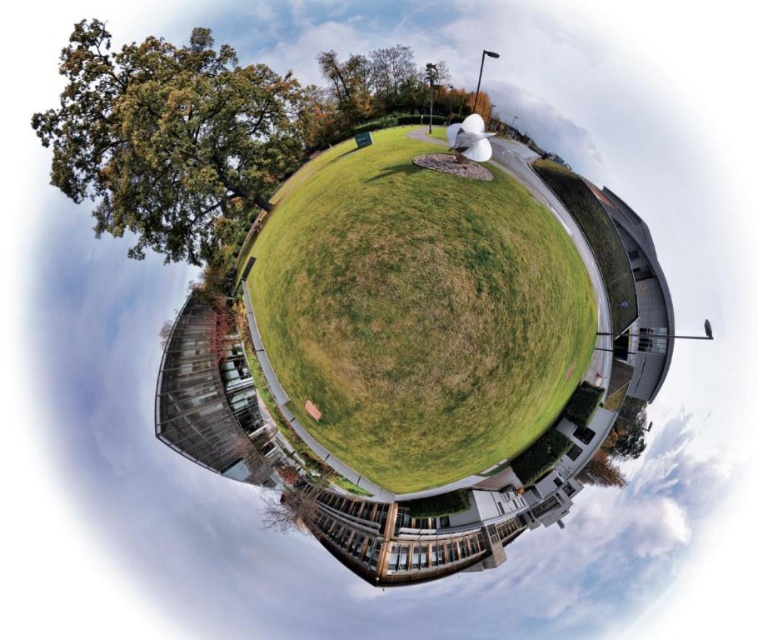
Question: Is green grassy at center closer to camera compared to green leafy tree at upper left?

Choices:
 (A) no
 (B) yes

Answer: (A)

Question: Which object is farther from the camera taking this photo?

Choices:
 (A) green grassy at center
 (B) green leafy tree at upper left

Answer: (A)

Question: Can you confirm if green grassy at center is positioned below green leafy tree at upper left?

Choices:
 (A) no
 (B) yes

Answer: (B)

Question: Which of the following is the closest to the observer?

Choices:
 (A) (89, 86)
 (B) (362, 445)

Answer: (A)

Question: Is green grassy at center bigger than green leafy tree at upper left?

Choices:
 (A) yes
 (B) no

Answer: (A)